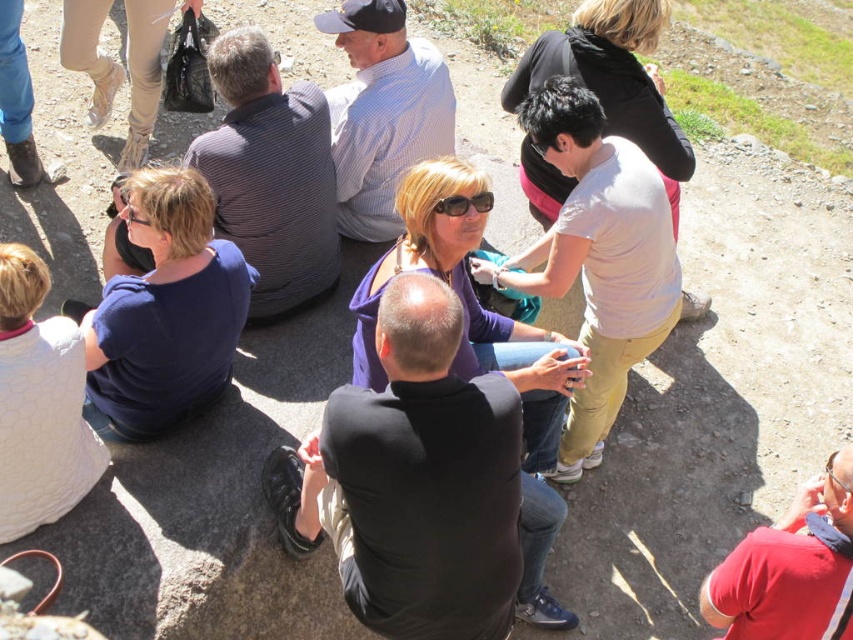
Is red cotton shirt at lower right thinner than black plastic sunglasses at center?

No, red cotton shirt at lower right is not thinner than black plastic sunglasses at center.

Locate an element on the screen. The image size is (853, 640). red cotton shirt at lower right is located at coordinates (791, 566).